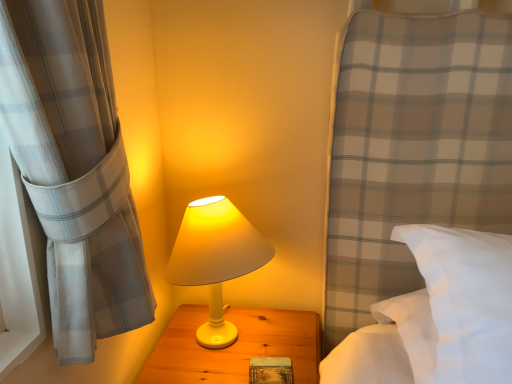
The height and width of the screenshot is (384, 512). What are the coordinates of `vacant space to the right of white matte lamp at center` in the screenshot? It's located at (296, 343).